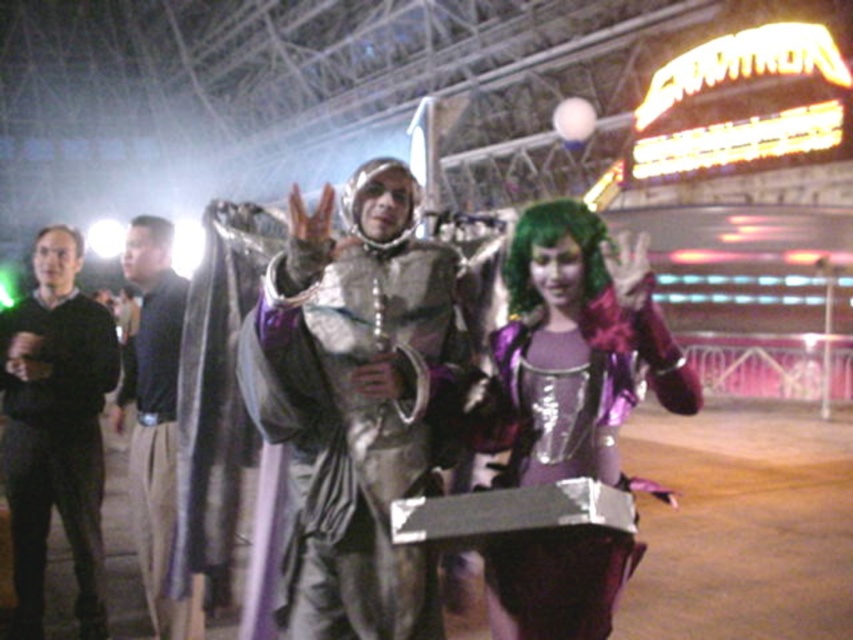
Question: Is metallic silver costume at center closer to the viewer compared to shiny black wig at upper left?

Choices:
 (A) no
 (B) yes

Answer: (B)

Question: Does metallic silver costume at center appear on the left side of dark brown leather jacket at left?

Choices:
 (A) no
 (B) yes

Answer: (A)

Question: Can you confirm if metallic silver costume at center is positioned to the left of shiny silver armor at center?

Choices:
 (A) no
 (B) yes

Answer: (A)

Question: Which object is closer to the camera taking this photo?

Choices:
 (A) shiny black wig at upper left
 (B) dark brown leather jacket at left

Answer: (B)

Question: Estimate the real-world distances between objects in this image. Which object is closer to the dark brown leather jacket at left?

Choices:
 (A) black matte sweater at left
 (B) green synthetic wig at center

Answer: (A)

Question: Which point is closer to the camera?

Choices:
 (A) black matte sweater at left
 (B) shiny purple dress at center

Answer: (B)